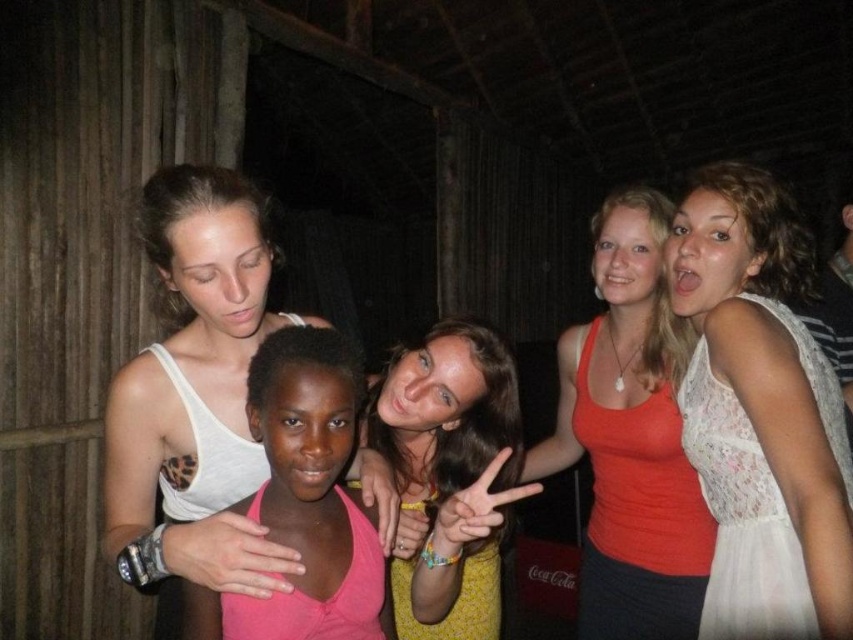
Where is the white tank top at upper left located in the image?

The white tank top at upper left is located at point (x=196, y=394) in the image.

You are standing at the point marked as point (602, 289) in the image. You want to take a photo of the group of five people in the rustic setting. Will you be able to capture the entire group in your camera frame without moving from your current position?

The point marked as point (602, 289) is 5.54 feet away from the viewer. Since the group is in the same general area, you should be able to capture them all in the frame from that distance, assuming the camera has a wide enough lens.

You are a photographer standing at the back of the room. You want to take a photo that includes both the white tank top at upper left and the matte orange tank top at center. Given that your camera has a maximum focus range of 25 inches, can you capture both subjects in focus without moving closer?

The distance between the white tank top at upper left and the matte orange tank top at center is 28.79 inches, which exceeds the camera maximum focus range of 25 inches. Therefore, you cannot capture both subjects in focus without moving closer.